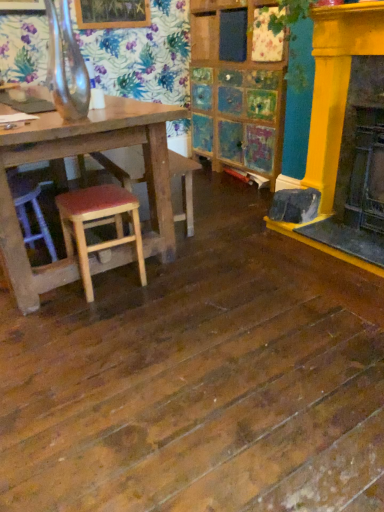
Question: Is yellow painted wood fireplace at right positioned beyond the bounds of wooden seat at center?

Choices:
 (A) no
 (B) yes

Answer: (B)

Question: Could you tell me if yellow painted wood fireplace at right is facing wooden seat at center?

Choices:
 (A) yes
 (B) no

Answer: (B)

Question: Is yellow painted wood fireplace at right next to wooden seat at center and touching it?

Choices:
 (A) yes
 (B) no

Answer: (B)

Question: Can you confirm if yellow painted wood fireplace at right is thinner than wooden seat at center?

Choices:
 (A) no
 (B) yes

Answer: (B)

Question: Is yellow painted wood fireplace at right smaller than wooden seat at center?

Choices:
 (A) yes
 (B) no

Answer: (A)

Question: Is wooden seat at center wider or thinner than wooden stool with red cushion at lower left?

Choices:
 (A) wide
 (B) thin

Answer: (A)

Question: From a real-world perspective, is wooden seat at center above or below wooden stool with red cushion at lower left?

Choices:
 (A) above
 (B) below

Answer: (A)

Question: From the image's perspective, relative to wooden stool with red cushion at lower left, is wooden seat at center above or below?

Choices:
 (A) below
 (B) above

Answer: (B)

Question: Looking at the image, does wooden seat at center seem bigger or smaller compared to wooden stool with red cushion at lower left?

Choices:
 (A) small
 (B) big

Answer: (B)

Question: Does point (84, 208) appear closer or farther from the camera than point (130, 165)?

Choices:
 (A) farther
 (B) closer

Answer: (B)

Question: In terms of width, does wooden stool with red cushion at lower left look wider or thinner when compared to wooden seat at center?

Choices:
 (A) thin
 (B) wide

Answer: (A)

Question: From the image's perspective, is wooden stool with red cushion at lower left positioned above or below wooden seat at center?

Choices:
 (A) below
 (B) above

Answer: (A)

Question: In terms of height, does wooden stool with red cushion at lower left look taller or shorter compared to wooden seat at center?

Choices:
 (A) short
 (B) tall

Answer: (A)

Question: Based on their positions, is yellow painted wood fireplace at right located to the left or right of wooden seat at center?

Choices:
 (A) left
 (B) right

Answer: (B)

Question: From a real-world perspective, is yellow painted wood fireplace at right positioned above or below wooden seat at center?

Choices:
 (A) above
 (B) below

Answer: (A)